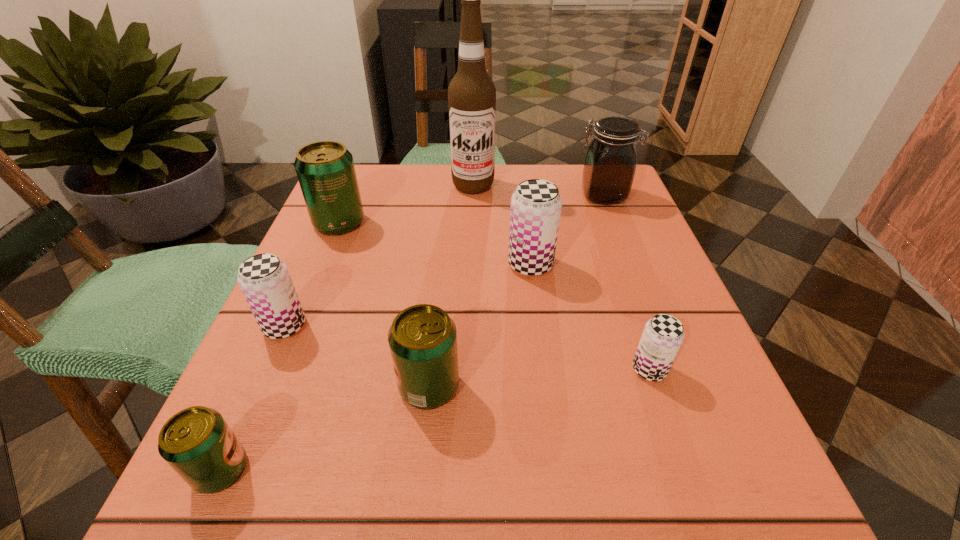
The width and height of the screenshot is (960, 540). In order to click on empty space that is in between the nearest green beer can and the alcohol in this screenshot , I will do `click(347, 328)`.

Locate an element on the screen. This screenshot has width=960, height=540. free point between the rightmost beer can and the third object from right to left is located at coordinates (589, 317).

Locate an element on the screen. empty space between the jar and the leftmost purple beer can is located at coordinates click(444, 261).

Identify the location of vacant area between the smallest green beer can and the rightmost green beer can. The width and height of the screenshot is (960, 540). (324, 428).

The height and width of the screenshot is (540, 960). In order to click on empty space between the second biggest green beer can and the farthest green beer can in this screenshot , I will do `click(384, 304)`.

This screenshot has height=540, width=960. Find the location of `vacant area that lies between the farthest green beer can and the rightmost beer can`. vacant area that lies between the farthest green beer can and the rightmost beer can is located at coordinates (494, 296).

You are a GUI agent. You are given a task and a screenshot of the screen. Output one action in this format:
    pyautogui.click(x=<x>, y=<y>)
    Task: Click on the free spot between the biggest green beer can and the sixth object from left to right
    
    Given the screenshot: What is the action you would take?
    pyautogui.click(x=435, y=244)

I want to click on free area in between the biggest purple beer can and the alcohol, so click(x=502, y=225).

Where is `the fourth closest object to the leftmost purple beer can`? This screenshot has height=540, width=960. the fourth closest object to the leftmost purple beer can is located at coordinates (536, 204).

Locate which object is the third closest to the farthest beer can. Please provide its 2D coordinates. Your answer should be formatted as a tuple, i.e. [(x, y)], where the tuple contains the x and y coordinates of a point satisfying the conditions above.

[(536, 204)]